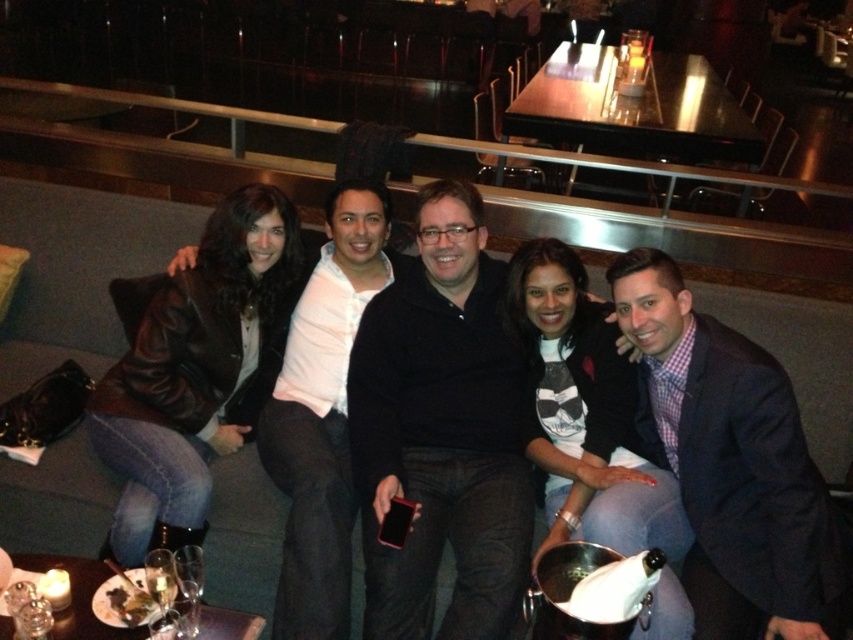
Question: Is leather jacket at left bigger than matte black jacket at center?

Choices:
 (A) yes
 (B) no

Answer: (B)

Question: Which of these objects is positioned farthest from the dark blue suit at right?

Choices:
 (A) white shirt at center
 (B) black matte shirt at center
 (C) leather couch at center
 (D) matte black jacket at center

Answer: (C)

Question: Where is leather couch at center located in relation to leather jacket at left in the image?

Choices:
 (A) below
 (B) above

Answer: (B)

Question: Which point is farther from the camera taking this photo?

Choices:
 (A) (697, 625)
 (B) (415, 586)
 (C) (650, 532)

Answer: (C)

Question: Which point is closer to the camera?

Choices:
 (A) leather couch at center
 (B) leather jacket at left

Answer: (B)

Question: Can you confirm if dark blue suit at right is positioned to the left of white shirt at center?

Choices:
 (A) yes
 (B) no

Answer: (B)